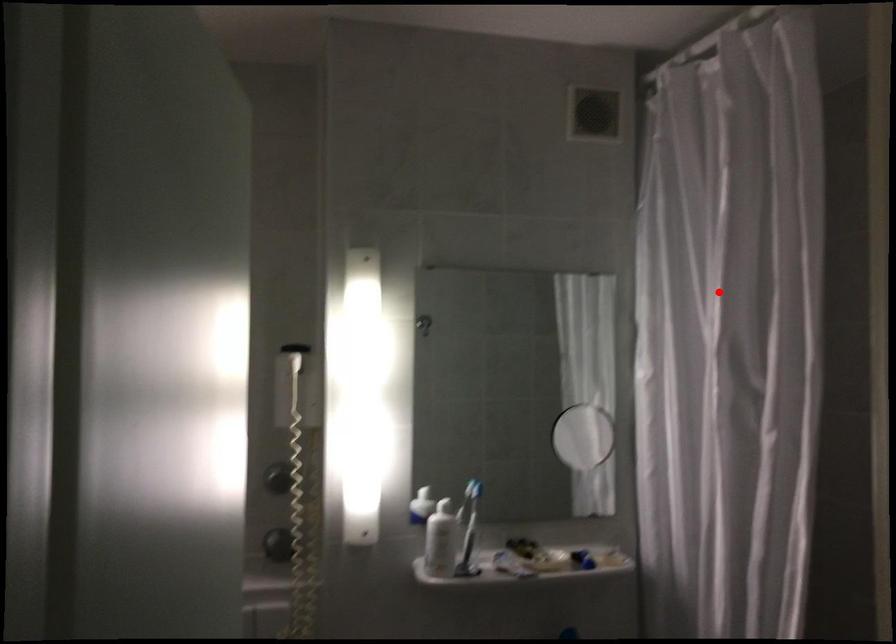
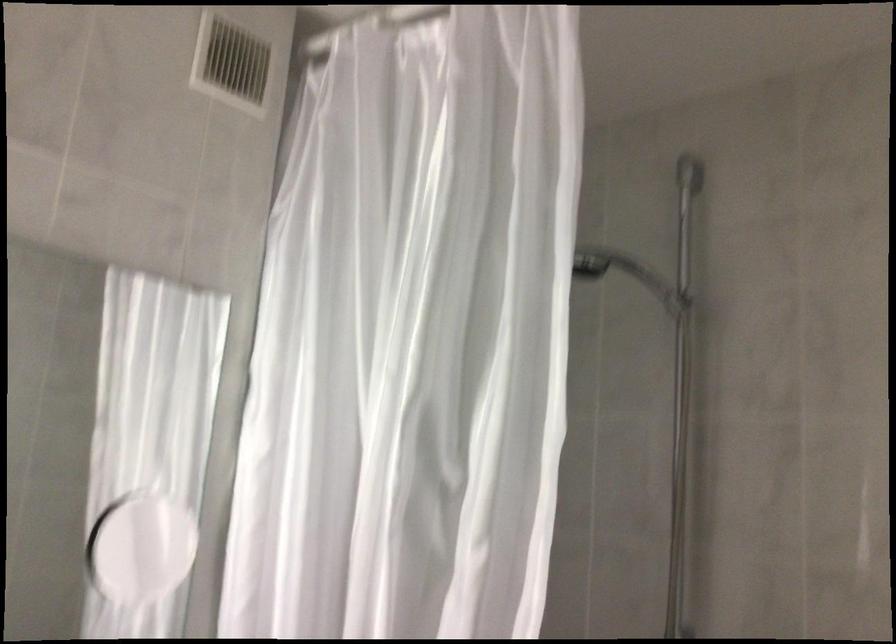
The point at the highlighted location is marked in the first image. Where is the corresponding point in the second image?

(412, 337)